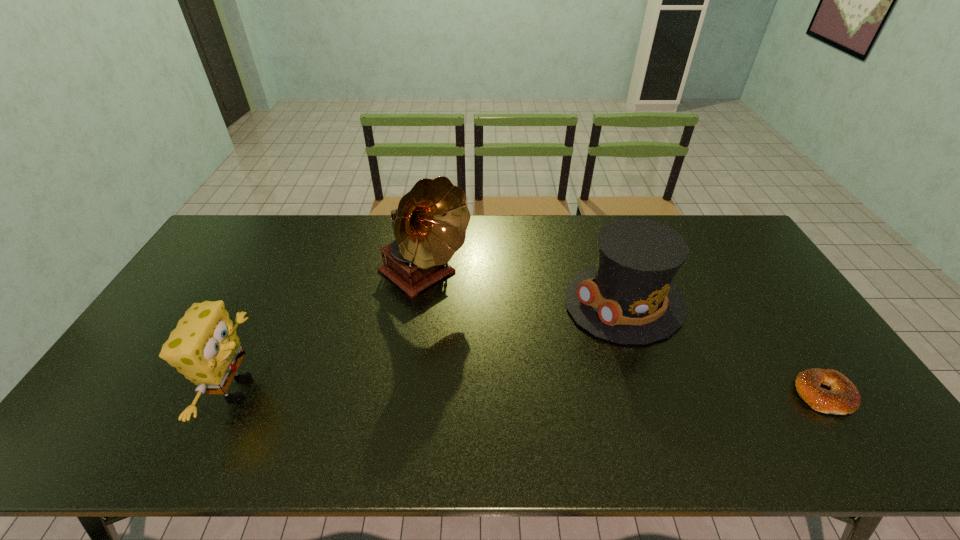
This screenshot has width=960, height=540. In order to click on the leftmost object in this screenshot , I will do `click(204, 347)`.

Locate an element on the screen. bagel is located at coordinates (843, 398).

Find the location of `the rightmost object`. the rightmost object is located at coordinates (843, 398).

I want to click on the tallest object, so click(x=430, y=223).

Image resolution: width=960 pixels, height=540 pixels. Find the location of `phonograph_record`. phonograph_record is located at coordinates pyautogui.click(x=430, y=223).

Where is `the second object from right to left`? The width and height of the screenshot is (960, 540). the second object from right to left is located at coordinates (629, 298).

This screenshot has height=540, width=960. What are the coordinates of `free space located 0.130m on the face of the leftmost object` in the screenshot? It's located at (311, 389).

Find the location of a particular element. free space located on the left of the bagel is located at coordinates (648, 395).

Identify the location of vacant space located 0.290m on the horn of the phonograph_record. pos(525,356).

The image size is (960, 540). In order to click on vacant space located 0.160m on the horn of the phonograph_record in this screenshot , I will do `click(492, 329)`.